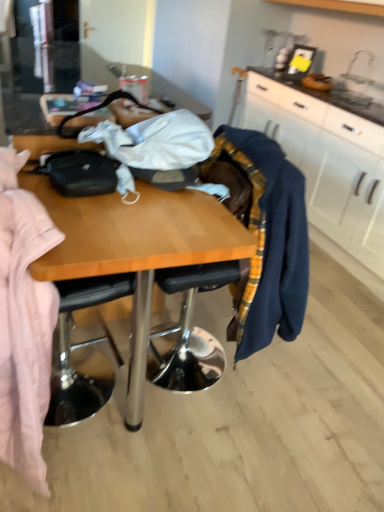
Question: Is metallic silver chair at center positioned with its back to navy blue sweater at right?

Choices:
 (A) yes
 (B) no

Answer: (A)

Question: From a real-world perspective, is metallic silver chair at center positioned over navy blue sweater at right based on gravity?

Choices:
 (A) yes
 (B) no

Answer: (B)

Question: Is the surface of metallic silver chair at center in direct contact with navy blue sweater at right?

Choices:
 (A) yes
 (B) no

Answer: (B)

Question: Considering the relative sizes of metallic silver chair at center and navy blue sweater at right in the image provided, is metallic silver chair at center taller than navy blue sweater at right?

Choices:
 (A) no
 (B) yes

Answer: (B)

Question: Is there a large distance between metallic silver chair at center and navy blue sweater at right?

Choices:
 (A) yes
 (B) no

Answer: (B)

Question: Based on their positions, is metallic silver chair at center located to the left or right of white matte cabinet at upper right?

Choices:
 (A) right
 (B) left

Answer: (B)

Question: Which is correct: metallic silver chair at center is inside white matte cabinet at upper right, or outside of it?

Choices:
 (A) outside
 (B) inside

Answer: (A)

Question: Considering the positions of metallic silver chair at center and white matte cabinet at upper right in the image, is metallic silver chair at center wider or thinner than white matte cabinet at upper right?

Choices:
 (A) thin
 (B) wide

Answer: (B)

Question: Considering their positions, is metallic silver chair at center located in front of or behind white matte cabinet at upper right?

Choices:
 (A) behind
 (B) front

Answer: (B)

Question: In the image, is metallic silver chair at center positioned in front of or behind navy blue sweater at right?

Choices:
 (A) behind
 (B) front

Answer: (B)

Question: Which is correct: metallic silver chair at center is inside navy blue sweater at right, or outside of it?

Choices:
 (A) outside
 (B) inside

Answer: (A)

Question: From a real-world perspective, is metallic silver chair at center positioned above or below navy blue sweater at right?

Choices:
 (A) above
 (B) below

Answer: (B)

Question: Considering the positions of metallic silver chair at center and navy blue sweater at right in the image, is metallic silver chair at center wider or thinner than navy blue sweater at right?

Choices:
 (A) wide
 (B) thin

Answer: (A)

Question: From the image's perspective, is white matte cabinet at upper right positioned above or below navy blue sweater at right?

Choices:
 (A) above
 (B) below

Answer: (A)

Question: Considering the positions of point (372, 214) and point (256, 344), is point (372, 214) closer or farther from the camera than point (256, 344)?

Choices:
 (A) closer
 (B) farther

Answer: (B)